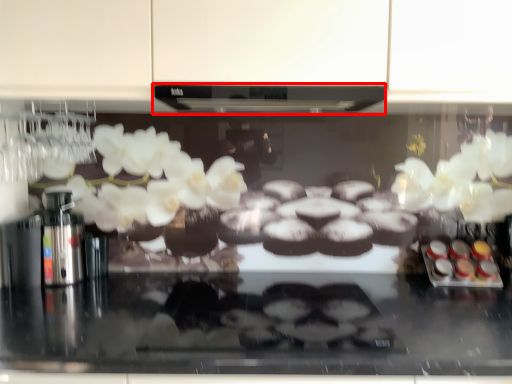
Question: From the image's perspective, what is the correct spatial relationship of exhaust hood (annotated by the red box) in relation to food?

Choices:
 (A) below
 (B) above

Answer: (B)